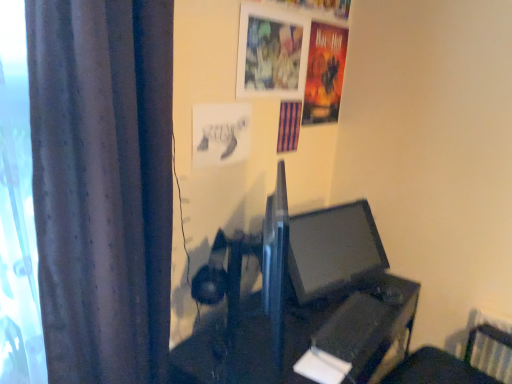
Find the location of a particular element. This screenshot has width=512, height=384. free spot above black plastic table at center (from a real-world perspective) is located at coordinates (325, 316).